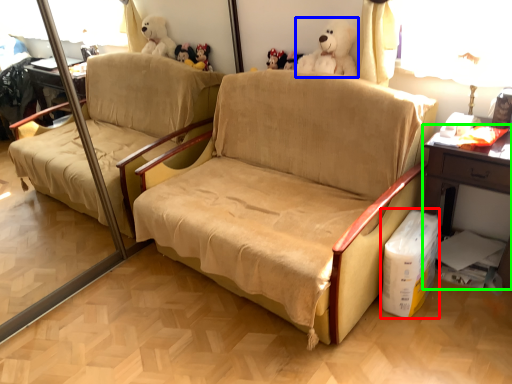
Question: Considering the real-world distances, which object is farthest from cardboard box (highlighted by a red box)? toy (highlighted by a blue box) or table (highlighted by a green box)?

Choices:
 (A) toy
 (B) table

Answer: (A)